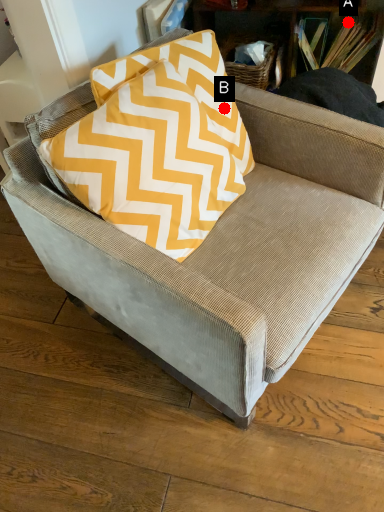
Question: Two points are circled on the image, labeled by A and B beside each circle. Which of the following is the closest to the observer?

Choices:
 (A) A is closer
 (B) B is closer

Answer: (B)